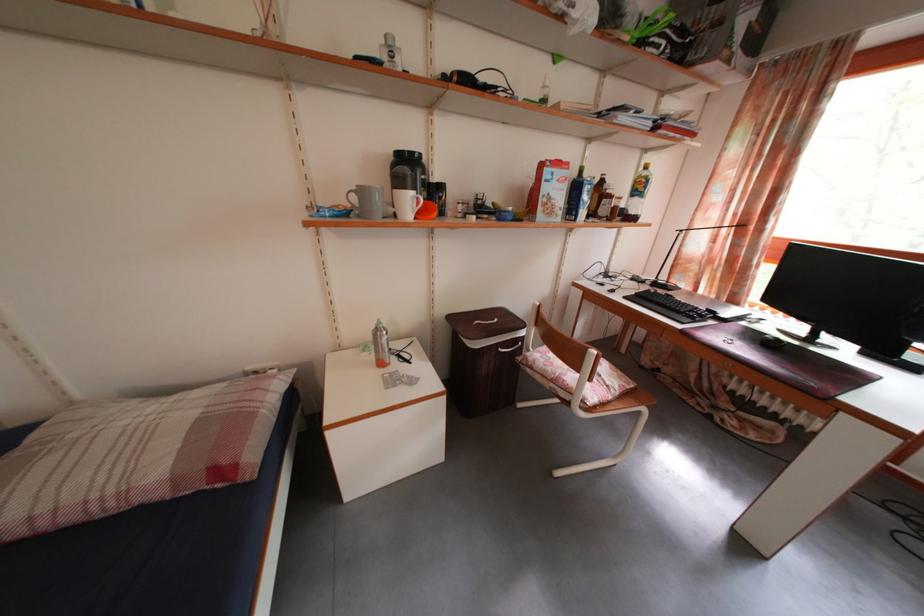
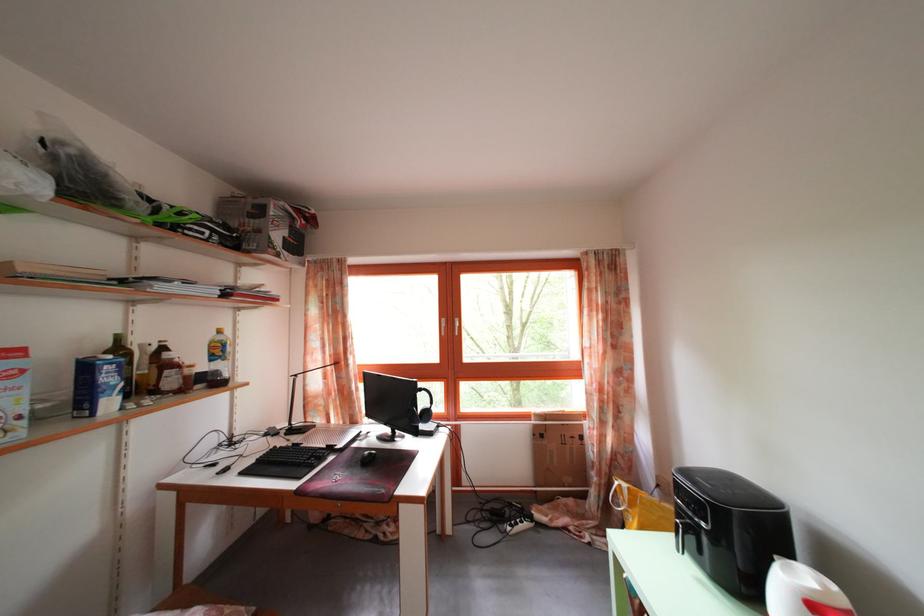
The point at (589, 177) is marked in the first image. Where is the corresponding point in the second image?

(126, 346)